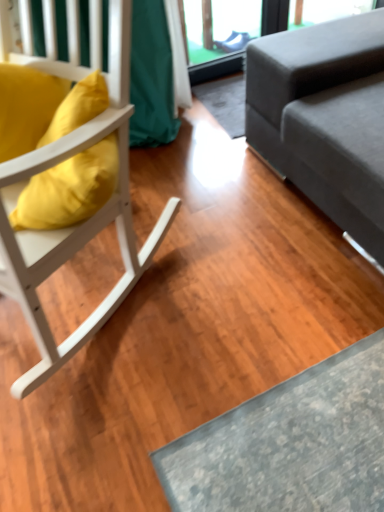
Question: Considering the relative sizes of gray fabric couch at right and matte yellow pillow at left in the image provided, is gray fabric couch at right wider than matte yellow pillow at left?

Choices:
 (A) yes
 (B) no

Answer: (A)

Question: Is gray fabric couch at right taller than matte yellow pillow at left?

Choices:
 (A) no
 (B) yes

Answer: (B)

Question: From a real-world perspective, is gray fabric couch at right on top of matte yellow pillow at left?

Choices:
 (A) no
 (B) yes

Answer: (A)

Question: Can matte yellow pillow at left be found inside gray fabric couch at right?

Choices:
 (A) yes
 (B) no

Answer: (B)

Question: Does gray fabric couch at right have a smaller size compared to matte yellow pillow at left?

Choices:
 (A) no
 (B) yes

Answer: (A)

Question: Is point (51, 159) closer or farther from the camera than point (337, 111)?

Choices:
 (A) closer
 (B) farther

Answer: (A)

Question: From a real-world perspective, is white wood chair at left physically located above or below gray fabric couch at right?

Choices:
 (A) below
 (B) above

Answer: (B)

Question: From their relative heights in the image, would you say white wood chair at left is taller or shorter than gray fabric couch at right?

Choices:
 (A) short
 (B) tall

Answer: (B)

Question: Based on their sizes in the image, would you say white wood chair at left is bigger or smaller than gray fabric couch at right?

Choices:
 (A) small
 (B) big

Answer: (A)

Question: Is gray fabric couch at right to the left or to the right of white wood chair at left in the image?

Choices:
 (A) left
 (B) right

Answer: (B)

Question: Is gray fabric couch at right wider or thinner than white wood chair at left?

Choices:
 (A) wide
 (B) thin

Answer: (A)

Question: Considering the positions of point 274,153 and point 122,185, is point 274,153 closer or farther from the camera than point 122,185?

Choices:
 (A) closer
 (B) farther

Answer: (B)

Question: Is gray fabric couch at right bigger or smaller than white wood chair at left?

Choices:
 (A) small
 (B) big

Answer: (B)

Question: Is matte yellow pillow at left to the left or to the right of gray fabric couch at right in the image?

Choices:
 (A) left
 (B) right

Answer: (A)

Question: From a real-world perspective, is matte yellow pillow at left positioned above or below gray fabric couch at right?

Choices:
 (A) below
 (B) above

Answer: (B)